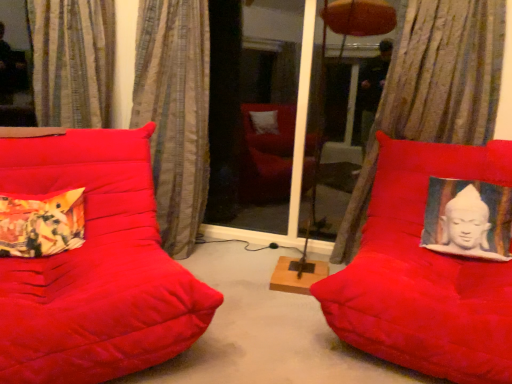
Question: Is textured beige curtain at upper right, which is the 1th curtain in right-to-left order, aimed at textured beige curtain at left, which is the 2th curtain in left-to-right order?

Choices:
 (A) no
 (B) yes

Answer: (A)

Question: Can you see textured beige curtain at upper right, which is the 1th curtain in right-to-left order, touching textured beige curtain at left, which is counted as the second curtain, starting from the right?

Choices:
 (A) yes
 (B) no

Answer: (B)

Question: Does textured beige curtain at upper right, which is the 1th curtain in right-to-left order, have a greater height compared to textured beige curtain at left, which is counted as the second curtain, starting from the right?

Choices:
 (A) yes
 (B) no

Answer: (A)

Question: Can you confirm if textured beige curtain at upper right, positioned as the 3th curtain in left-to-right order, is positioned to the right of textured beige curtain at left, which is the 2th curtain in left-to-right order?

Choices:
 (A) yes
 (B) no

Answer: (A)

Question: Can you confirm if textured beige curtain at upper right, which is the 1th curtain in right-to-left order, is smaller than textured beige curtain at left, which is counted as the second curtain, starting from the right?

Choices:
 (A) no
 (B) yes

Answer: (A)

Question: Is textured beige curtain at upper right, positioned as the 3th curtain in left-to-right order, facing away from textured beige curtain at left, which is counted as the second curtain, starting from the right?

Choices:
 (A) no
 (B) yes

Answer: (A)

Question: Considering the relative sizes of floral fabric cushion at left and transparent glass screen door at center in the image provided, is floral fabric cushion at left thinner than transparent glass screen door at center?

Choices:
 (A) no
 (B) yes

Answer: (A)

Question: Is floral fabric cushion at left with transparent glass screen door at center?

Choices:
 (A) yes
 (B) no

Answer: (B)

Question: Does floral fabric cushion at left have a greater height compared to transparent glass screen door at center?

Choices:
 (A) yes
 (B) no

Answer: (B)

Question: From the image's perspective, is floral fabric cushion at left under transparent glass screen door at center?

Choices:
 (A) yes
 (B) no

Answer: (A)

Question: Is there a large distance between floral fabric cushion at left and transparent glass screen door at center?

Choices:
 (A) no
 (B) yes

Answer: (B)

Question: Is the position of floral fabric cushion at left more distant than that of transparent glass screen door at center?

Choices:
 (A) yes
 (B) no

Answer: (B)

Question: Can you confirm if textured beige curtain at left, which is counted as the second curtain, starting from the right, is shorter than striped fabric curtain at upper left, arranged as the 3th curtain when viewed from the right?

Choices:
 (A) no
 (B) yes

Answer: (A)